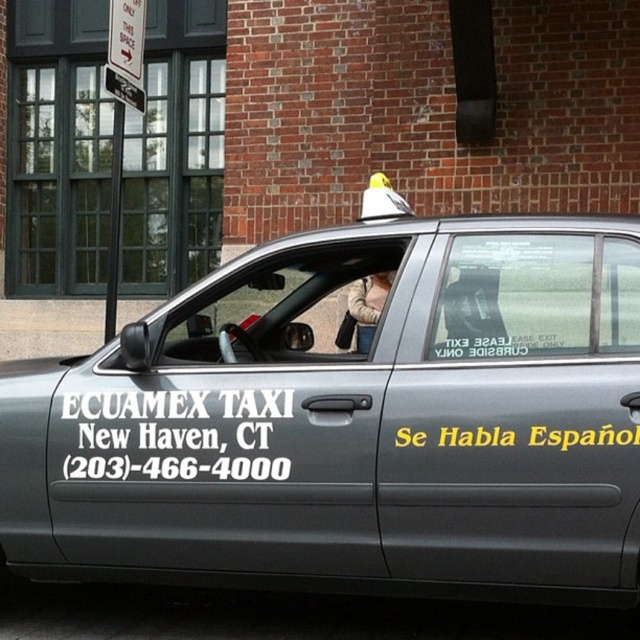
You are a delivery person who needs to place a beige fuzzy jacket at center into the trunk of the metallic gray taxi at center. Based on the size of the jacket and the taxi, will the jacket fit inside the trunk?

The metallic gray taxi at center is larger in size than beige fuzzy jacket at center, so the jacket will fit inside the trunk.

You are a pedestrian standing in front of the metallic gray taxi at center. You want to pick up the beige fuzzy jacket at center. Which direction should you move to reach it?

The beige fuzzy jacket at center is to the right of the metallic gray taxi at center, so you should move to your right to reach it.

Looking at this image, you are a pedestrian standing at the curb and see the metallic gray taxi at center and the beige fuzzy jacket at center. Which object is closer to you?

The beige fuzzy jacket at center is closer to you because it is above the metallic gray taxi at center.